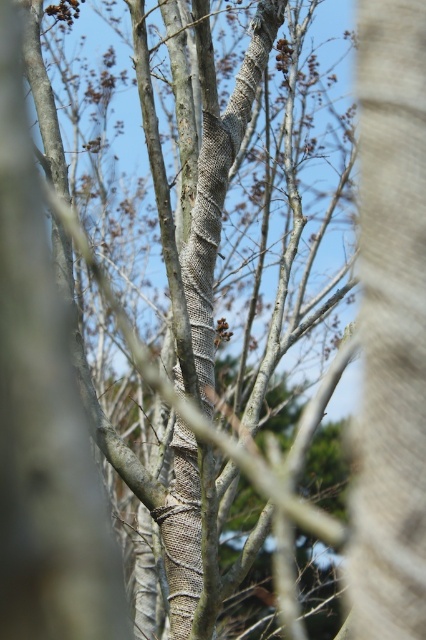
Based on the photo, who is positioned more to the left, smooth bark tree trunk at center or burlap-like textured tree trunk at center?

From the viewer's perspective, burlap-like textured tree trunk at center appears more on the left side.

Does smooth bark tree trunk at center appear on the left side of burlap-like textured tree trunk at center?

No, smooth bark tree trunk at center is not to the left of burlap-like textured tree trunk at center.

Locate an element on the screen. The width and height of the screenshot is (426, 640). smooth bark tree trunk at center is located at coordinates (391, 324).